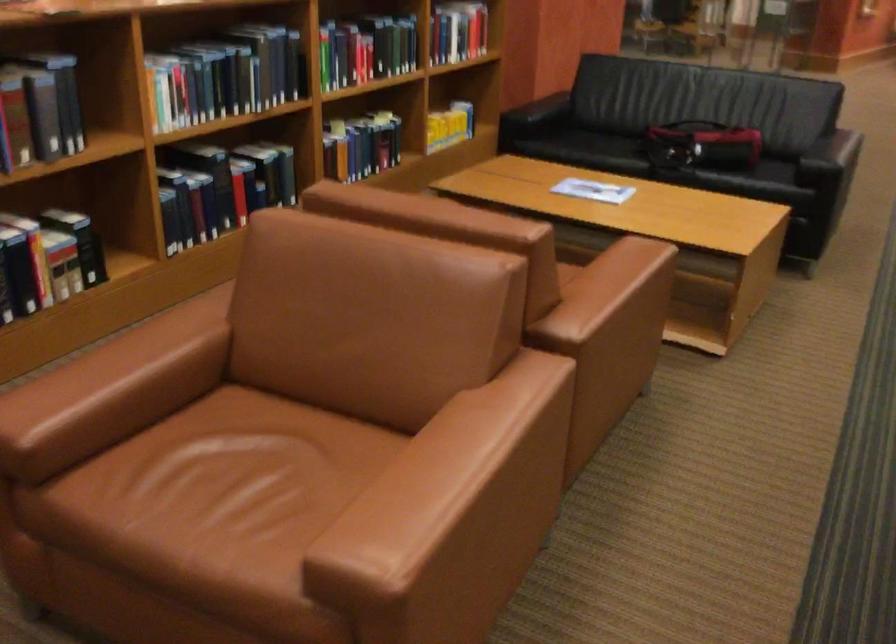
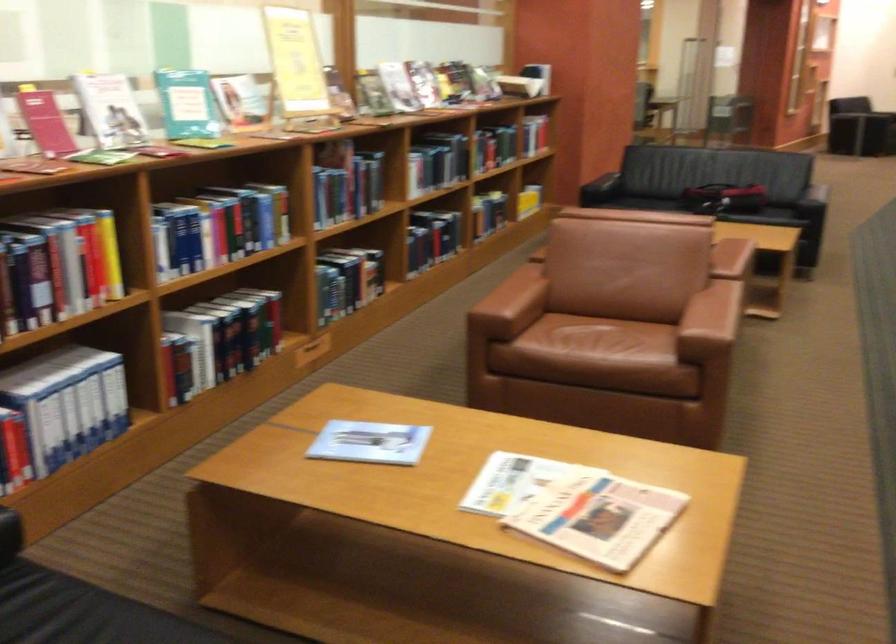
Find the pixel in the second image that matches [675,166] in the first image.

(725, 198)